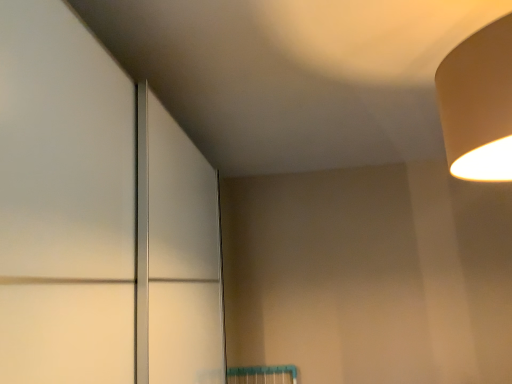
Question: From a real-world perspective, relative to beige matte lampshade at upper right, is matte white door at center vertically above or below?

Choices:
 (A) below
 (B) above

Answer: (A)

Question: Considering the positions of matte white door at center and beige matte lampshade at upper right in the image, is matte white door at center bigger or smaller than beige matte lampshade at upper right?

Choices:
 (A) big
 (B) small

Answer: (A)

Question: Considering the relative positions of matte white door at center and beige matte lampshade at upper right in the image provided, is matte white door at center to the left or to the right of beige matte lampshade at upper right?

Choices:
 (A) left
 (B) right

Answer: (A)

Question: Is beige matte lampshade at upper right to the left or to the right of matte white door at center in the image?

Choices:
 (A) right
 (B) left

Answer: (A)

Question: From the image's perspective, is beige matte lampshade at upper right positioned above or below matte white door at center?

Choices:
 (A) below
 (B) above

Answer: (B)

Question: Is beige matte lampshade at upper right wider or thinner than matte white door at center?

Choices:
 (A) wide
 (B) thin

Answer: (B)

Question: In terms of size, does beige matte lampshade at upper right appear bigger or smaller than matte white door at center?

Choices:
 (A) big
 (B) small

Answer: (B)